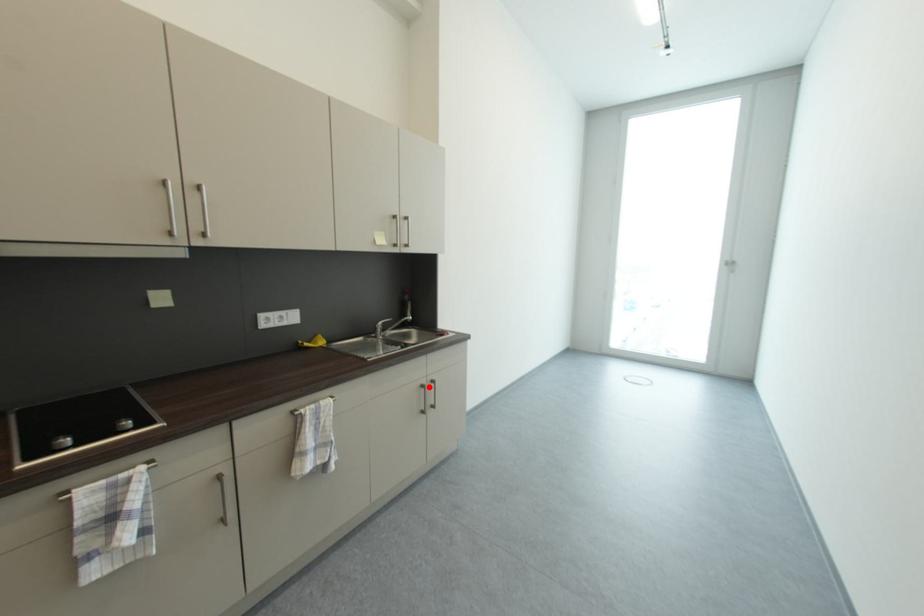
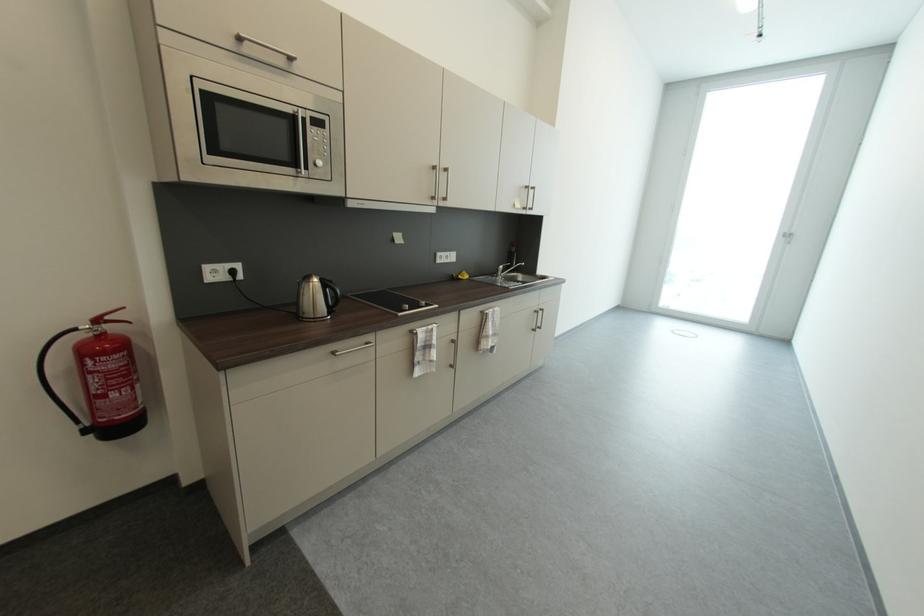
Question: I am providing you with two images of the same scene from different viewpoints. A red point is marked on the first image. Is the red point's position out of view in image 2?

Choices:
 (A) Yes
 (B) No

Answer: (B)